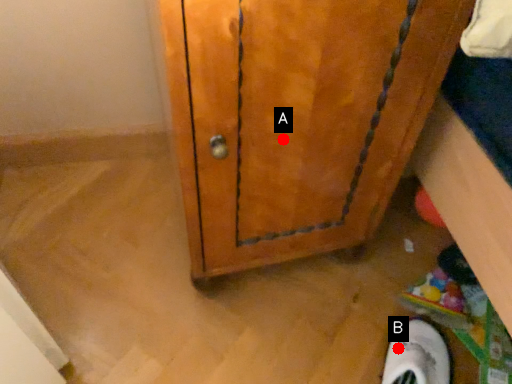
Question: Two points are circled on the image, labeled by A and B beside each circle. Which point appears closest to the camera in this image?

Choices:
 (A) A is closer
 (B) B is closer

Answer: (A)